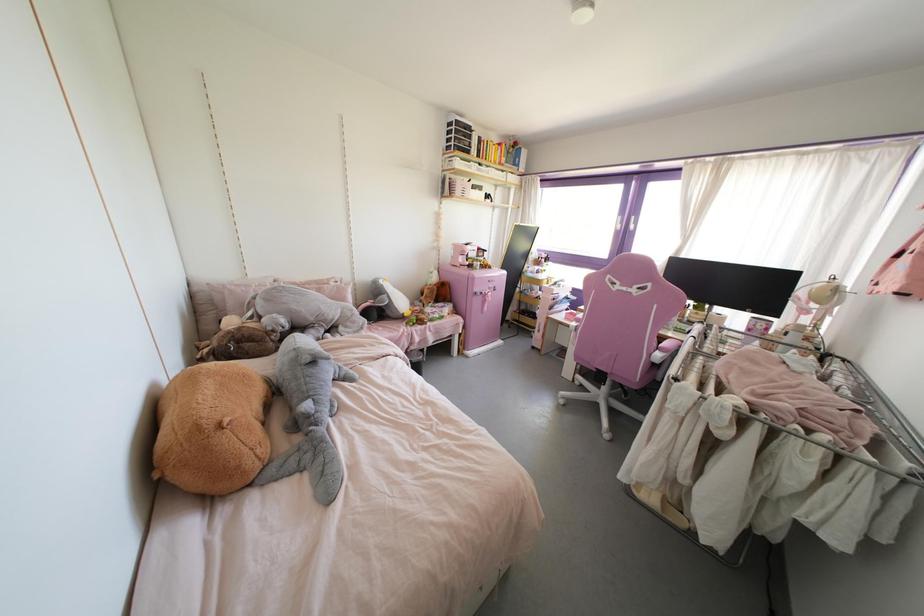
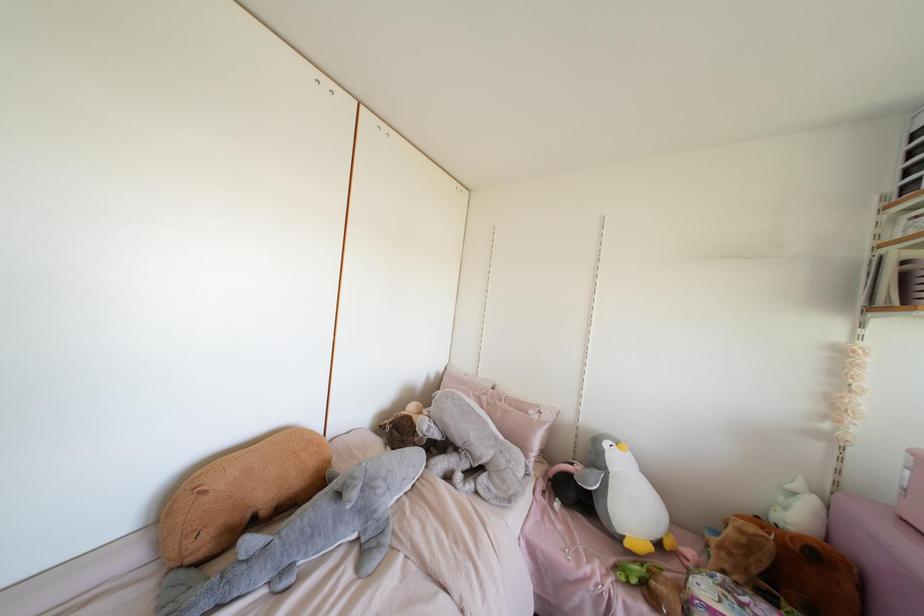
In the second image, find the point that corresponds to (332,283) in the first image.

(530, 411)